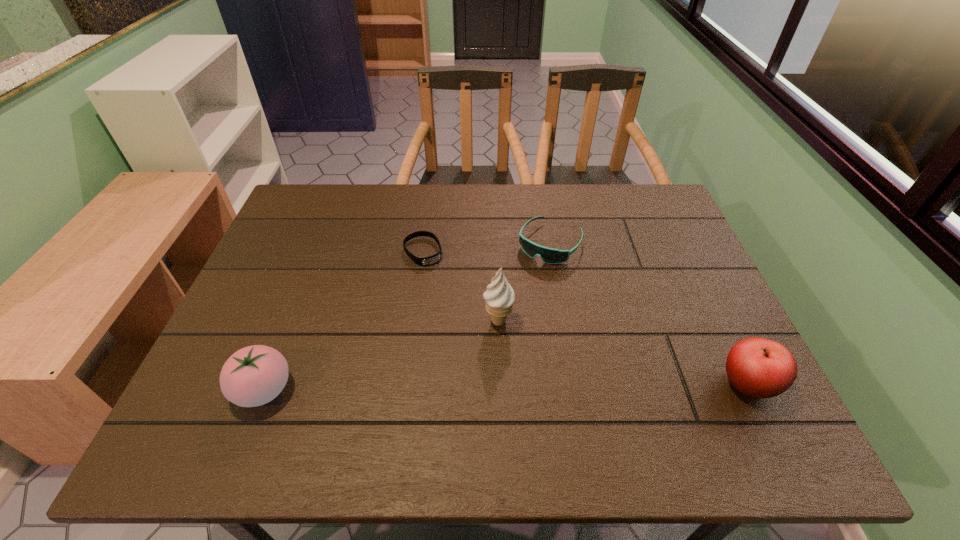
Locate an element on the screen. The image size is (960, 540). free space on the desktop that is between the tomato and the rightmost object and is positioned on the front-facing side of the second shortest object is located at coordinates (452, 388).

Where is `free space on the desktop that is between the tomato and the rightmost object and is positioned on the display of the fourth object from right to left`? free space on the desktop that is between the tomato and the rightmost object and is positioned on the display of the fourth object from right to left is located at coordinates (513, 387).

The height and width of the screenshot is (540, 960). Identify the location of free spot on the desktop that is between the leftmost object and the rightmost object and is positioned on the front-facing side of the third object from right to left. (564, 387).